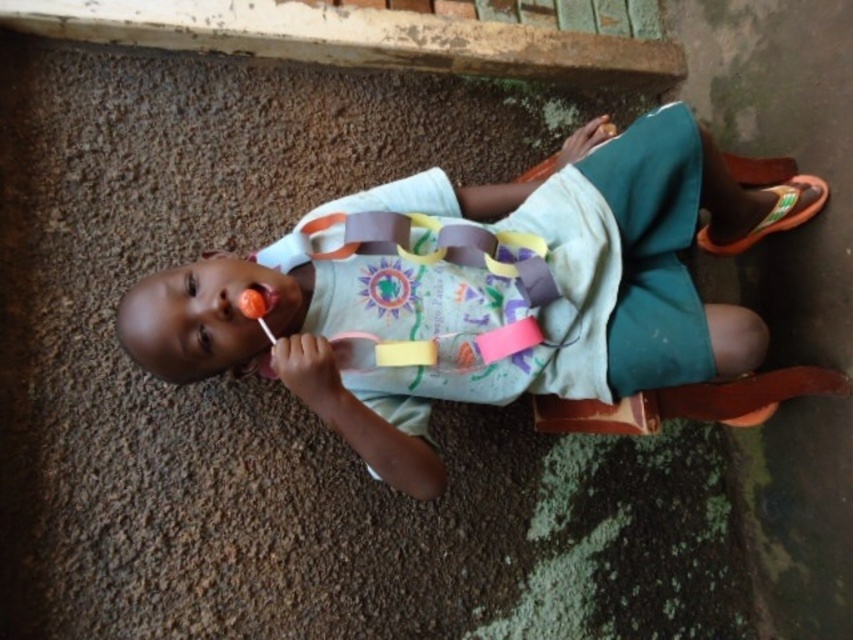
Question: Does matte plastic lollipop at center have a greater width compared to orange fabric sandal at right?

Choices:
 (A) no
 (B) yes

Answer: (B)

Question: Considering the real-world distances, which object is farthest from the matte plastic lollipop at center?

Choices:
 (A) yellow paper strap at center
 (B) orange fabric sandal at right

Answer: (B)

Question: Considering the real-world distances, which object is closest to the orange fabric sandal at right?

Choices:
 (A) matte plastic lollipop at center
 (B) yellow paper strap at center

Answer: (A)

Question: Which of these objects is positioned closest to the orange fabric sandal at right?

Choices:
 (A) yellow paper strap at center
 (B) matte plastic lollipop at center

Answer: (B)

Question: Is matte plastic lollipop at center above yellow paper strap at center?

Choices:
 (A) no
 (B) yes

Answer: (A)

Question: Can you confirm if matte plastic lollipop at center is positioned above orange fabric sandal at right?

Choices:
 (A) yes
 (B) no

Answer: (B)